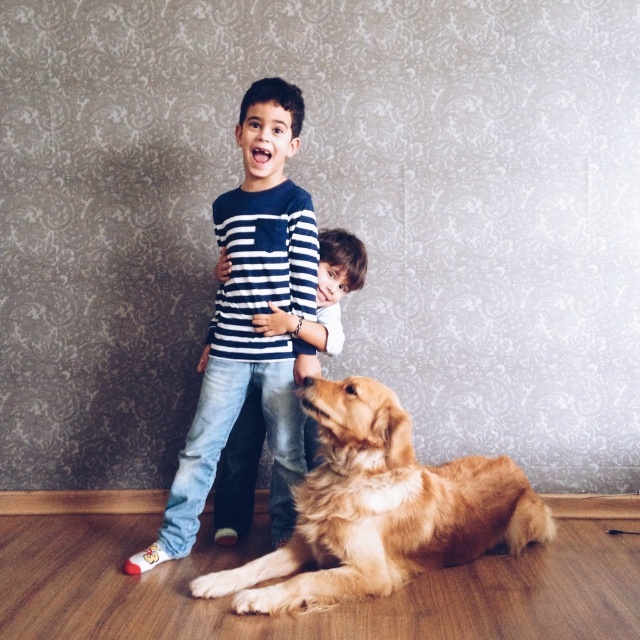
You are a photographer trying to capture the golden fur dog at lower center and the striped cotton shirt at center in the same frame. Based on their positions, which object is located to the left of the other?

The golden fur dog at lower center is positioned on the right side of striped cotton shirt at center, so the striped cotton shirt at center is to the left of the golden fur dog at lower center.

You are standing in the room and see the golden retriever lying on the wooden floor. There is a specific point at coordinates [380,509]. Can you tell me where this point is located in relation to the golden retriever?

The point at coordinates [380,509] is located on the golden fur dog at lower center.